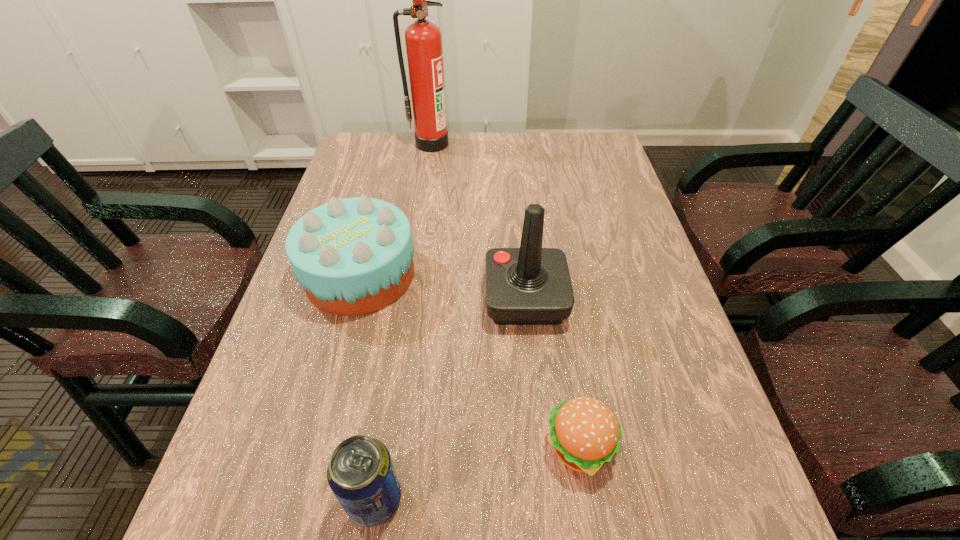
At what (x,y) coordinates should I click in order to perform the action: click on vacant space that satisfies the following two spatial constraints: 1. with the nozzle pointing from the back of the tallest object; 2. on the right side of the shortest object. Please return your answer as a coordinate pair (x, y). Looking at the image, I should click on (385, 446).

Where is `vacant space that satisfies the following two spatial constraints: 1. with the nozzle pointing from the back of the hamburger; 2. on the left side of the fire extinguisher`? vacant space that satisfies the following two spatial constraints: 1. with the nozzle pointing from the back of the hamburger; 2. on the left side of the fire extinguisher is located at coordinates (385, 446).